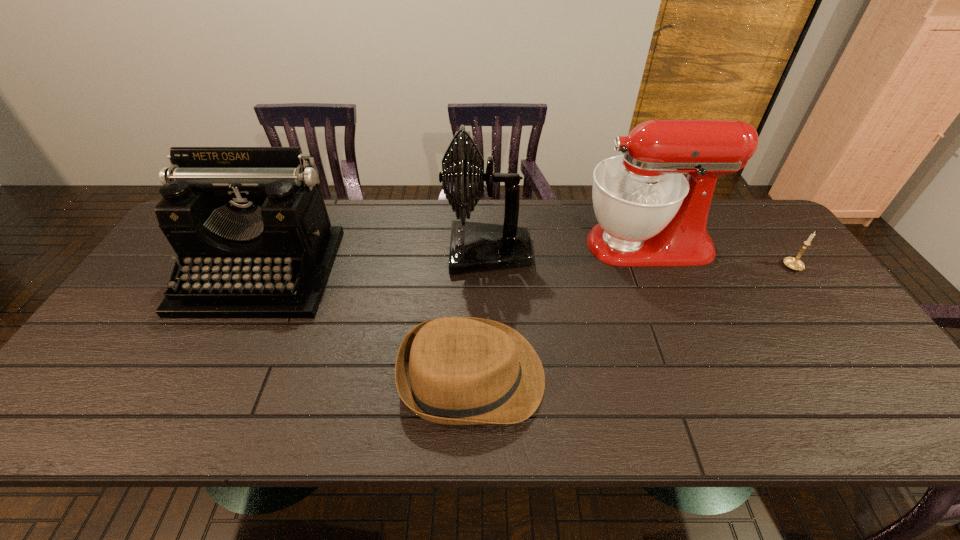
Where is `object that is at the right edge`? The width and height of the screenshot is (960, 540). object that is at the right edge is located at coordinates (793, 263).

Identify the location of object that is at the far left corner. (249, 225).

Locate an element on the screen. This screenshot has height=540, width=960. vacant space at the far edge is located at coordinates (369, 237).

At what (x,y) coordinates should I click in order to perform the action: click on free point at the near edge. Please return your answer as a coordinate pair (x, y). Looking at the image, I should click on (622, 401).

Where is `free space at the left edge of the desktop`? free space at the left edge of the desktop is located at coordinates (105, 361).

You are a GUI agent. You are given a task and a screenshot of the screen. Output one action in this format:
    pyautogui.click(x=<x>, y=<y>)
    Task: Click on the vacant space at the right edge of the desktop
    This screenshot has height=540, width=960.
    Given the screenshot: What is the action you would take?
    pyautogui.click(x=858, y=390)

I want to click on free space between the fedora and the fan, so click(480, 314).

The image size is (960, 540). In order to click on vacant space in between the fedora and the second object from right to left in this screenshot , I will do `click(560, 310)`.

Where is `free space between the fedora and the rightmost object`? free space between the fedora and the rightmost object is located at coordinates (633, 322).

Locate an element on the screen. The image size is (960, 540). free spot between the rightmost object and the second object from right to left is located at coordinates (720, 256).